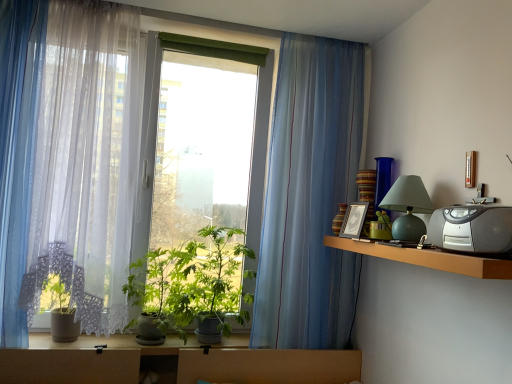
Locate an element on the screen. The image size is (512, 384). transparent fabric at left is located at coordinates (327, 202).

Describe the element at coordinates (428, 258) in the screenshot. I see `brown wooden shelf at right` at that location.

You are a GUI agent. You are given a task and a screenshot of the screen. Output one action in this format:
    pyautogui.click(x=<x>, y=<y>)
    Task: Click on the matte green glass table lamp at right
    This screenshot has width=512, height=384.
    Given the screenshot: What is the action you would take?
    pyautogui.click(x=408, y=207)

This screenshot has width=512, height=384. What do you see at coordinates (67, 159) in the screenshot? I see `translucent white curtain at left, positioned as the 2th curtain in left-to-right order` at bounding box center [67, 159].

How much space does translucent white curtain at left, positioned as the 2th curtain in left-to-right order, occupy horizontally?

It is 28.24 centimeters.

Locate an element on the screen. This screenshot has width=512, height=384. transparent fabric at left is located at coordinates (327, 202).

Can we say brown wooden shelf at right lies outside silver plastic radio at upper right?

Yes.

What are the coordinates of `appliance above the brown wooden shelf at right (from a real-world perspective)` in the screenshot? It's located at (472, 229).

Which is less distant, (485, 264) or (467, 212)?

Point (485, 264).

Can you tell me how much translucent fabric curtain at left, which is the 1th curtain from left to right, and green matte plant at center differ in facing direction?

translucent fabric curtain at left, which is the 1th curtain from left to right, and green matte plant at center are facing 0.586 degrees away from each other.

From a real-world perspective, is translucent fabric curtain at left, which is the 1th curtain from left to right, on green matte plant at center?

Yes.

Is translucent fabric curtain at left, which is the 3th curtain from right to left, turned away from green matte plant at center?

No, translucent fabric curtain at left, which is the 3th curtain from right to left,'s orientation is not away from green matte plant at center.

Would you say translucent blue curtain at center, acting as the first curtain starting from the right, is to the left or to the right of translucent white curtain at left, positioned as the 2th curtain in left-to-right order, in the picture?

From the image, it's evident that translucent blue curtain at center, acting as the first curtain starting from the right, is to the right of translucent white curtain at left, positioned as the 2th curtain in left-to-right order.

Considering the positions of point (340, 294) and point (63, 86), is point (340, 294) closer or farther from the camera than point (63, 86)?

Point (340, 294) is positioned farther from the camera compared to point (63, 86).

Based on the photo, does translucent blue curtain at center, arranged as the 3th curtain when viewed from the left, have a greater height compared to translucent white curtain at left, positioned as the 2th curtain in left-to-right order?

Yes.

Considering the relative sizes of translucent fabric curtain at left, which is the 1th curtain from left to right, and matte green glass table lamp at right in the image provided, is translucent fabric curtain at left, which is the 1th curtain from left to right, taller than matte green glass table lamp at right?

Correct, translucent fabric curtain at left, which is the 1th curtain from left to right, is much taller as matte green glass table lamp at right.

Based on the photo, could you tell me if translucent fabric curtain at left, which is the 1th curtain from left to right, is turned towards matte green glass table lamp at right?

No, translucent fabric curtain at left, which is the 1th curtain from left to right, is not oriented towards matte green glass table lamp at right.

Between translucent fabric curtain at left, which is the 3th curtain from right to left, and matte green glass table lamp at right, which one has larger size?

Bigger between the two is translucent fabric curtain at left, which is the 3th curtain from right to left.

You are a GUI agent. You are given a task and a screenshot of the screen. Output one action in this format:
    pyautogui.click(x=<x>, y=<y>)
    Task: Click on the table lamp in front of the translucent fabric curtain at left, which is the 3th curtain from right to left
    The height and width of the screenshot is (384, 512).
    Given the screenshot: What is the action you would take?
    [x=408, y=207]

From a real-world perspective, between translucent white curtain at left, positioned as the 2th curtain in left-to-right order, and translucent blue curtain at center, acting as the first curtain starting from the right, who is vertically lower?

translucent blue curtain at center, acting as the first curtain starting from the right, is physically lower.

Is translucent white curtain at left, placed as the second curtain when sorted from right to left, facing towards translucent blue curtain at center, arranged as the 3th curtain when viewed from the left?

No.

Is point (49, 225) positioned before point (285, 59)?

Yes, point (49, 225) is closer to viewer.

Locate an element on the screen. appliance in front of the translucent blue curtain at center, arranged as the 3th curtain when viewed from the left is located at coordinates (472, 229).

Relative to translucent blue curtain at center, acting as the first curtain starting from the right, is silver plastic radio at upper right in front or behind?

silver plastic radio at upper right is in front of translucent blue curtain at center, acting as the first curtain starting from the right.

Consider the image. Looking at their sizes, would you say silver plastic radio at upper right is wider or thinner than translucent blue curtain at center, arranged as the 3th curtain when viewed from the left?

Clearly, silver plastic radio at upper right has more width compared to translucent blue curtain at center, arranged as the 3th curtain when viewed from the left.

Based on their sizes in the image, would you say silver plastic radio at upper right is bigger or smaller than translucent blue curtain at center, arranged as the 3th curtain when viewed from the left?

Considering their sizes, silver plastic radio at upper right takes up less space than translucent blue curtain at center, arranged as the 3th curtain when viewed from the left.

Is green matte plant at center next to translucent blue curtain at center, arranged as the 3th curtain when viewed from the left?

No, green matte plant at center is not next to translucent blue curtain at center, arranged as the 3th curtain when viewed from the left.

Would you say green matte plant at center is outside translucent blue curtain at center, arranged as the 3th curtain when viewed from the left?

Yes, green matte plant at center is not within translucent blue curtain at center, arranged as the 3th curtain when viewed from the left.

From a real-world perspective, starting from the green matte plant at center, which curtain is the 1st one vertically above it? Please provide its 2D coordinates.

[(309, 196)]

Measure the distance from green matte plant at center to translucent blue curtain at center, arranged as the 3th curtain when viewed from the left.

They are 46.80 centimeters apart.

At what (x,y) coordinates should I click in order to perform the action: click on shelf directly beneath the silver plastic radio at upper right (from a real-world perspective). Please return your answer as a coordinate pair (x, y). The height and width of the screenshot is (384, 512). Looking at the image, I should click on (428, 258).

You are a GUI agent. You are given a task and a screenshot of the screen. Output one action in this format:
    pyautogui.click(x=<x>, y=<y>)
    Task: Click on the 2nd curtain to the left of the green matte plant at center, counting from the anchor's position
    This screenshot has height=384, width=512.
    Given the screenshot: What is the action you would take?
    pyautogui.click(x=18, y=151)

Which object lies nearer to the anchor point transparent fabric at left, translucent fabric curtain at left, which is the 3th curtain from right to left, or silver plastic radio at upper right?

silver plastic radio at upper right lies closer to transparent fabric at left than the other object.

Which object lies further to the anchor point translucent fabric curtain at left, which is the 3th curtain from right to left, matte green glass table lamp at right or green matte plant at center?

matte green glass table lamp at right.

From the picture: Considering their positions, is matte green glass table lamp at right positioned further to transparent fabric at left than brown wooden shelf at right?

Among the two, brown wooden shelf at right is located further to transparent fabric at left.

Based on their spatial positions, is matte green glass table lamp at right or translucent blue curtain at center, acting as the first curtain starting from the right, further from translucent fabric curtain at left, which is the 1th curtain from left to right?

matte green glass table lamp at right lies further to translucent fabric curtain at left, which is the 1th curtain from left to right, than the other object.

Based on their spatial positions, is translucent fabric curtain at left, which is the 3th curtain from right to left, or brown wooden shelf at right closer to translucent blue curtain at center, arranged as the 3th curtain when viewed from the left?

The object closer to translucent blue curtain at center, arranged as the 3th curtain when viewed from the left, is brown wooden shelf at right.

When comparing their distances from green matte plant at center, does translucent white curtain at left, placed as the second curtain when sorted from right to left, or translucent fabric curtain at left, which is the 3th curtain from right to left, seem further?

Among the two, translucent fabric curtain at left, which is the 3th curtain from right to left, is located further to green matte plant at center.

Estimate the real-world distances between objects in this image. Which object is closer to translucent white curtain at left, positioned as the 2th curtain in left-to-right order, silver plastic radio at upper right or matte green glass table lamp at right?

matte green glass table lamp at right is positioned closer to the anchor translucent white curtain at left, positioned as the 2th curtain in left-to-right order.

Based on their spatial positions, is matte green glass table lamp at right or silver plastic radio at upper right further from translucent fabric curtain at left, which is the 3th curtain from right to left?

silver plastic radio at upper right.

Where is `shelf located between translucent white curtain at left, placed as the second curtain when sorted from right to left, and silver plastic radio at upper right in the left-right direction`? The image size is (512, 384). shelf located between translucent white curtain at left, placed as the second curtain when sorted from right to left, and silver plastic radio at upper right in the left-right direction is located at coordinates (428, 258).

In order to click on table lamp between green matte plant at center and silver plastic radio at upper right from left to right in this screenshot , I will do `click(408, 207)`.

Where is `curtain between green matte plant at center and matte green glass table lamp at right from left to right`? The image size is (512, 384). curtain between green matte plant at center and matte green glass table lamp at right from left to right is located at coordinates (309, 196).

This screenshot has width=512, height=384. Find the location of `curtain between translucent fabric curtain at left, which is the 1th curtain from left to right, and transparent fabric at left, in the horizontal direction`. curtain between translucent fabric curtain at left, which is the 1th curtain from left to right, and transparent fabric at left, in the horizontal direction is located at coordinates (67, 159).